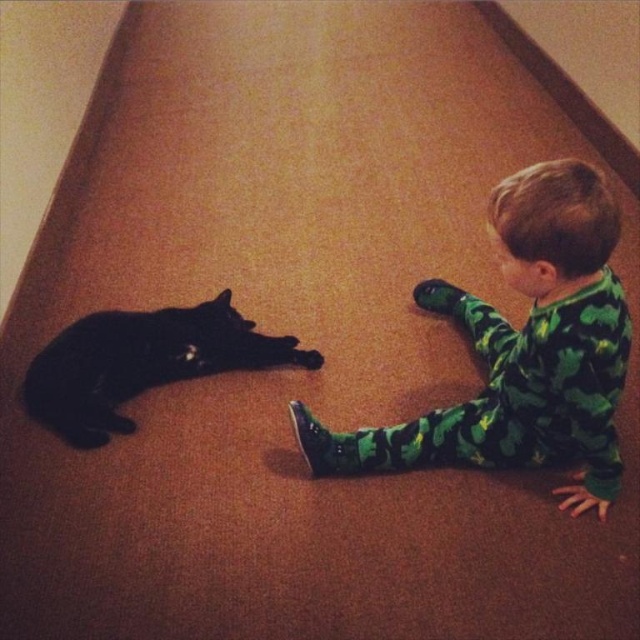
Is green camouflage pajamas at lower right below green matte paw at lower center?

Indeed, green camouflage pajamas at lower right is positioned under green matte paw at lower center.

Is point (584, 228) positioned behind point (452, 296)?

No, (584, 228) is closer to viewer.

Find the location of a particular element. This screenshot has width=640, height=640. green camouflage pajamas at lower right is located at coordinates (524, 349).

Can you confirm if black fur cat at left is thinner than green matte paw at lower center?

No, black fur cat at left is not thinner than green matte paw at lower center.

Does black fur cat at left lie behind green matte paw at lower center?

No, black fur cat at left is in front of green matte paw at lower center.

Who is more distant from viewer, (99,436) or (420,294)?

Point (420,294)

Where is `black fur cat at left`? This screenshot has width=640, height=640. black fur cat at left is located at coordinates (141, 364).

Is green camouflage pajamas at lower right thinner than black fur cat at left?

A: Indeed, green camouflage pajamas at lower right has a lesser width compared to black fur cat at left.

Which is behind, point (608, 362) or point (241, 364)?

The point (241, 364) is more distant.

The image size is (640, 640). Find the location of `green camouflage pajamas at lower right`. green camouflage pajamas at lower right is located at coordinates (524, 349).